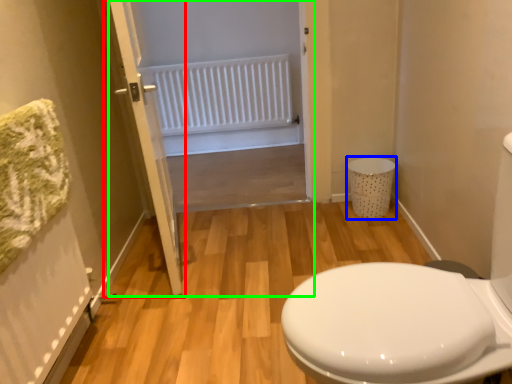
Question: Estimate the real-world distances between objects in this image. Which object is closer to door (highlighted by a red box), laundry basket (highlighted by a blue box) or screen door (highlighted by a green box)?

Choices:
 (A) laundry basket
 (B) screen door

Answer: (B)